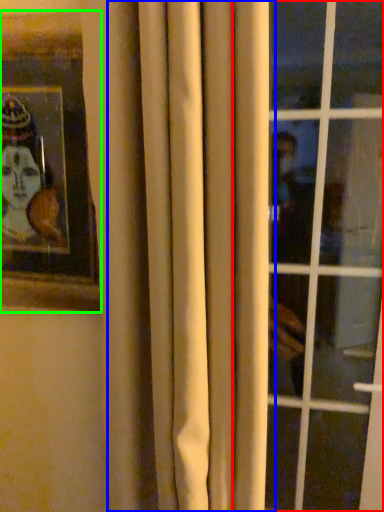
Question: Based on their relative distances, which object is farther from window (highlighted by a red box)? Choose from curtain (highlighted by a blue box) and picture frame (highlighted by a green box).

Choices:
 (A) curtain
 (B) picture frame

Answer: (B)